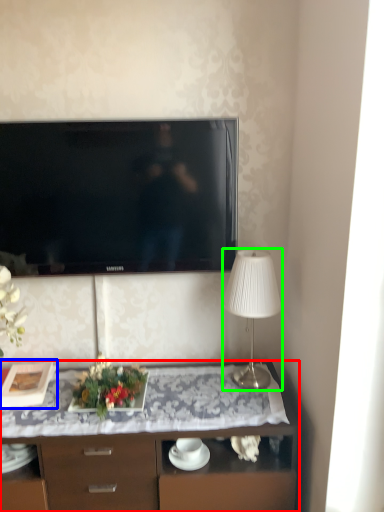
Question: Considering the real-world distances, which object is closest to desk (highlighted by a red box)? picture frame (highlighted by a blue box) or lamp (highlighted by a green box).

Choices:
 (A) picture frame
 (B) lamp

Answer: (B)